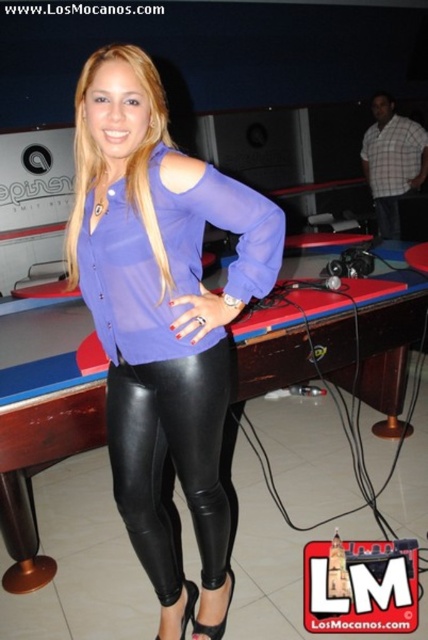
Question: Which object is farther from the camera taking this photo?

Choices:
 (A) matte purple blouse at center
 (B) black leather billiard table at center

Answer: (B)

Question: Can you confirm if black leather billiard table at center is positioned to the right of black leather leggings at center?

Choices:
 (A) yes
 (B) no

Answer: (A)

Question: Which of these objects is positioned farthest from the black leather billiard table at center?

Choices:
 (A) matte purple blouse at center
 (B) black leather leggings at center

Answer: (A)

Question: Is the position of matte purple blouse at center less distant than that of black leather billiard table at center?

Choices:
 (A) yes
 (B) no

Answer: (A)

Question: Estimate the real-world distances between objects in this image. Which object is farther from the matte purple blouse at center?

Choices:
 (A) black leather leggings at center
 (B) black leather billiard table at center

Answer: (B)

Question: Can you confirm if matte purple blouse at center is positioned below black leather billiard table at center?

Choices:
 (A) yes
 (B) no

Answer: (A)